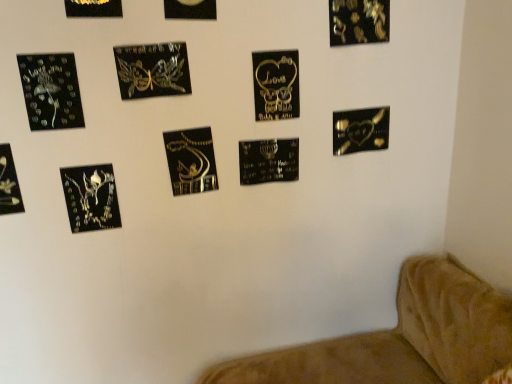
Locate an element on the screen. This screenshot has width=512, height=384. black glossy picture frame at upper center, the seventh picture frame viewed from the left is located at coordinates (190, 9).

This screenshot has height=384, width=512. What do you see at coordinates (276, 85) in the screenshot?
I see `black metallic plaque at center, placed as the third picture frame when sorted from right to left` at bounding box center [276, 85].

Locate an element on the screen. This screenshot has width=512, height=384. black metallic plaque at center, positioned as the ninth picture frame in left-to-right order is located at coordinates (276, 85).

How much space does black matte plaque at center, acting as the eighth picture frame starting from the left, occupy horizontally?

It is 1.59 inches.

Identify the location of black matte plaque at center, marked as the 4th picture frame in a right-to-left arrangement. (268, 161).

At what (x,y) coordinates should I click in order to perform the action: click on matte black bookmark at lower left, marked as the eleventh picture frame in a right-to-left arrangement. Please return your answer as a coordinate pair (x, y). Looking at the image, I should click on (9, 184).

How much space does matte black bookmark at lower left, marked as the eleventh picture frame in a right-to-left arrangement, occupy vertically?

matte black bookmark at lower left, marked as the eleventh picture frame in a right-to-left arrangement, is 8.39 inches tall.

How much space does black glossy picture frame at lower left, which is counted as the 3th picture frame, starting from the left, occupy horizontally?

The width of black glossy picture frame at lower left, which is counted as the 3th picture frame, starting from the left, is 1.72 centimeters.

Image resolution: width=512 pixels, height=384 pixels. What do you see at coordinates (91, 197) in the screenshot? I see `black glossy picture frame at lower left, which is counted as the 3th picture frame, starting from the left` at bounding box center [91, 197].

Describe the element at coordinates (358, 21) in the screenshot. The image size is (512, 384). I see `black glossy picture frame at upper right, which appears as the tenth picture frame when viewed from the left` at that location.

Where is `black glossy picture frame at upper center, which appears as the fifth picture frame when viewed from the right`? This screenshot has width=512, height=384. black glossy picture frame at upper center, which appears as the fifth picture frame when viewed from the right is located at coordinates (190, 9).

Is black metallic plaque at center, positioned as the ninth picture frame in left-to-right order, to the right of matte black bookmark at lower left, the 1th picture frame in the left-to-right sequence, from the viewer's perspective?

Yes.

Considering the relative sizes of black metallic plaque at center, positioned as the ninth picture frame in left-to-right order, and matte black bookmark at lower left, the 1th picture frame in the left-to-right sequence, in the image provided, is black metallic plaque at center, positioned as the ninth picture frame in left-to-right order, taller than matte black bookmark at lower left, the 1th picture frame in the left-to-right sequence,?

Indeed, black metallic plaque at center, positioned as the ninth picture frame in left-to-right order, has a greater height compared to matte black bookmark at lower left, the 1th picture frame in the left-to-right sequence.

How many degrees apart are the facing directions of black metallic plaque at center, placed as the third picture frame when sorted from right to left, and matte black bookmark at lower left, the 1th picture frame in the left-to-right sequence?

black metallic plaque at center, placed as the third picture frame when sorted from right to left, and matte black bookmark at lower left, the 1th picture frame in the left-to-right sequence, are facing 1.96 degrees away from each other.

From a real-world perspective, is black metallic plaque at center, placed as the third picture frame when sorted from right to left, on top of matte black bookmark at lower left, the 1th picture frame in the left-to-right sequence?

Correct, in the physical world, black metallic plaque at center, placed as the third picture frame when sorted from right to left, is higher than matte black bookmark at lower left, the 1th picture frame in the left-to-right sequence.

Locate an element on the screen. Image resolution: width=512 pixels, height=384 pixels. picture frame that is the 9th object located below the metallic gold picture frame at upper left, marked as the 8th picture frame in a right-to-left arrangement (from the image's perspective) is located at coordinates (91, 197).

Is metallic gold picture frame at upper left, marked as the 8th picture frame in a right-to-left arrangement, outside of black glossy picture frame at lower left, which is counted as the 3th picture frame, starting from the left?

Yes, metallic gold picture frame at upper left, marked as the 8th picture frame in a right-to-left arrangement, is not within black glossy picture frame at lower left, which is counted as the 3th picture frame, starting from the left.

Can you confirm if metallic gold picture frame at upper left, marked as the 8th picture frame in a right-to-left arrangement, is smaller than black glossy picture frame at lower left, which is counted as the 3th picture frame, starting from the left?

Indeed, metallic gold picture frame at upper left, marked as the 8th picture frame in a right-to-left arrangement, has a smaller size compared to black glossy picture frame at lower left, which is counted as the 3th picture frame, starting from the left.

Measure the distance between black glossy picture frame at lower left, which ranks as the 9th picture frame in right-to-left order, and black glossy picture frame at upper center, which appears as the fifth picture frame when viewed from the right.

black glossy picture frame at lower left, which ranks as the 9th picture frame in right-to-left order, is 22.38 inches away from black glossy picture frame at upper center, which appears as the fifth picture frame when viewed from the right.

Is black glossy picture frame at lower left, which ranks as the 9th picture frame in right-to-left order, spatially inside black glossy picture frame at upper center, the seventh picture frame viewed from the left, or outside of it?

black glossy picture frame at lower left, which ranks as the 9th picture frame in right-to-left order, is spatially situated outside black glossy picture frame at upper center, the seventh picture frame viewed from the left.

Considering the sizes of objects black glossy picture frame at lower left, which ranks as the 9th picture frame in right-to-left order, and black glossy picture frame at upper center, which appears as the fifth picture frame when viewed from the right, in the image provided, who is shorter, black glossy picture frame at lower left, which ranks as the 9th picture frame in right-to-left order, or black glossy picture frame at upper center, which appears as the fifth picture frame when viewed from the right,?

With less height is black glossy picture frame at upper center, which appears as the fifth picture frame when viewed from the right.

Is black glossy picture frame at lower left, which ranks as the 9th picture frame in right-to-left order, placed right next to black glossy picture frame at upper center, the seventh picture frame viewed from the left?

No, black glossy picture frame at lower left, which ranks as the 9th picture frame in right-to-left order, is not touching black glossy picture frame at upper center, the seventh picture frame viewed from the left.

Is black metallic plaque at center, positioned as the ninth picture frame in left-to-right order, bigger or smaller than matte black fairy at upper left, which is the 10th picture frame from right to left?

Clearly, black metallic plaque at center, positioned as the ninth picture frame in left-to-right order, is larger in size than matte black fairy at upper left, which is the 10th picture frame from right to left.

From a real-world perspective, which object rests below the other?

black metallic plaque at center, positioned as the ninth picture frame in left-to-right order.

In terms of width, does black metallic plaque at center, positioned as the ninth picture frame in left-to-right order, look wider or thinner when compared to matte black fairy at upper left, arranged as the second picture frame when viewed from the left?

Considering their sizes, black metallic plaque at center, positioned as the ninth picture frame in left-to-right order, looks broader than matte black fairy at upper left, arranged as the second picture frame when viewed from the left.

From the image's perspective, who appears lower, black metallic plaque at center, positioned as the ninth picture frame in left-to-right order, or matte black fairy at upper left, which is the 10th picture frame from right to left?

matte black fairy at upper left, which is the 10th picture frame from right to left, appears lower in the image.

In the image, is black matte plaque at center, marked as the 4th picture frame in a right-to-left arrangement, positioned in front of or behind metallic gold picture frame at upper left, positioned as the 4th picture frame in left-to-right order?

black matte plaque at center, marked as the 4th picture frame in a right-to-left arrangement, is positioned farther from the viewer than metallic gold picture frame at upper left, positioned as the 4th picture frame in left-to-right order.

Is black matte plaque at center, acting as the eighth picture frame starting from the left, not within metallic gold picture frame at upper left, positioned as the 4th picture frame in left-to-right order?

Yes.

From the image's perspective, count 6th picture frames upward from the black matte plaque at center, marked as the 4th picture frame in a right-to-left arrangement, and point to it. Please provide its 2D coordinates.

[(93, 8)]

Does black glossy picture frame at lower left, which ranks as the 9th picture frame in right-to-left order, have a greater width compared to metallic gold necklace at center, which is the sixth picture frame from right to left?

Incorrect, the width of black glossy picture frame at lower left, which ranks as the 9th picture frame in right-to-left order, does not surpass that of metallic gold necklace at center, which is the sixth picture frame from right to left.

From a real-world perspective, starting from the metallic gold necklace at center, which ranks as the 6th picture frame in left-to-right order, which picture frame is the 3rd one below it? Please provide its 2D coordinates.

[(91, 197)]

Looking at this image, is black glossy picture frame at lower left, which ranks as the 9th picture frame in right-to-left order, touching metallic gold necklace at center, which ranks as the 6th picture frame in left-to-right order?

No, black glossy picture frame at lower left, which ranks as the 9th picture frame in right-to-left order, is not making contact with metallic gold necklace at center, which ranks as the 6th picture frame in left-to-right order.

Is black glossy picture frame at lower left, which ranks as the 9th picture frame in right-to-left order, closer to the viewer compared to metallic gold necklace at center, which ranks as the 6th picture frame in left-to-right order?

That is True.

Is black glossy heart at lower right, which is the 1th picture frame in right-to-left order, to the left of matte black bookmark at lower left, the 1th picture frame in the left-to-right sequence, from the viewer's perspective?

No, black glossy heart at lower right, which is the 1th picture frame in right-to-left order, is not to the left of matte black bookmark at lower left, the 1th picture frame in the left-to-right sequence.

From a real-world perspective, who is located lower, black glossy heart at lower right, placed as the 11th picture frame when sorted from left to right, or matte black bookmark at lower left, marked as the eleventh picture frame in a right-to-left arrangement?

From a 3D spatial view, matte black bookmark at lower left, marked as the eleventh picture frame in a right-to-left arrangement, is below.

Which object is more forward, black glossy heart at lower right, which is the 1th picture frame in right-to-left order, or matte black bookmark at lower left, the 1th picture frame in the left-to-right sequence?

Positioned in front is matte black bookmark at lower left, the 1th picture frame in the left-to-right sequence.

Does black glossy heart at lower right, placed as the 11th picture frame when sorted from left to right, turn towards matte black bookmark at lower left, the 1th picture frame in the left-to-right sequence?

No, black glossy heart at lower right, placed as the 11th picture frame when sorted from left to right, is not aimed at matte black bookmark at lower left, the 1th picture frame in the left-to-right sequence.

Which picture frame is the 8th one when counting from the right side of the matte black bookmark at lower left, the 1th picture frame in the left-to-right sequence? Please provide its 2D coordinates.

[(276, 85)]

Image resolution: width=512 pixels, height=384 pixels. I want to click on the 5th picture frame in front of the black glossy picture frame at lower left, which ranks as the 9th picture frame in right-to-left order, starting your count from the anchor, so click(93, 8).

Looking at the image, which one is located closer to black glossy picture frame at upper center, the seventh picture frame viewed from the left, black glossy heart at lower right, which is the 1th picture frame in right-to-left order, or black metallic plaque at center, placed as the third picture frame when sorted from right to left?

The object closer to black glossy picture frame at upper center, the seventh picture frame viewed from the left, is black metallic plaque at center, placed as the third picture frame when sorted from right to left.

Which object lies nearer to the anchor point metallic gold butterfly at upper center, placed as the 7th picture frame when sorted from right to left, black glossy picture frame at upper right, which appears as the tenth picture frame when viewed from the left, or black glossy heart at lower right, placed as the 11th picture frame when sorted from left to right?

black glossy picture frame at upper right, which appears as the tenth picture frame when viewed from the left.

Looking at the image, which one is located closer to black glossy heart at lower right, which is the 1th picture frame in right-to-left order, metallic gold necklace at center, which is the sixth picture frame from right to left, or matte black fairy at upper left, which is the 10th picture frame from right to left?

metallic gold necklace at center, which is the sixth picture frame from right to left.

Considering their positions, is metallic gold butterfly at upper center, marked as the fifth picture frame in a left-to-right arrangement, positioned closer to metallic gold necklace at center, which ranks as the 6th picture frame in left-to-right order, than matte black bookmark at lower left, marked as the eleventh picture frame in a right-to-left arrangement?

metallic gold butterfly at upper center, marked as the fifth picture frame in a left-to-right arrangement, is positioned closer to the anchor metallic gold necklace at center, which ranks as the 6th picture frame in left-to-right order.

Looking at the image, which one is located further to metallic gold butterfly at upper center, placed as the 7th picture frame when sorted from right to left, matte black fairy at upper left, arranged as the second picture frame when viewed from the left, or black glossy heart at lower right, which is the 1th picture frame in right-to-left order?

black glossy heart at lower right, which is the 1th picture frame in right-to-left order, is further to metallic gold butterfly at upper center, placed as the 7th picture frame when sorted from right to left.

Estimate the real-world distances between objects in this image. Which object is closer to black glossy picture frame at upper right, which appears as the tenth picture frame when viewed from the left, matte black bookmark at lower left, the 1th picture frame in the left-to-right sequence, or metallic gold picture frame at upper left, marked as the 8th picture frame in a right-to-left arrangement?

metallic gold picture frame at upper left, marked as the 8th picture frame in a right-to-left arrangement.

From the image, which object appears to be farther from black metallic plaque at center, placed as the third picture frame when sorted from right to left, metallic gold necklace at center, which is the sixth picture frame from right to left, or matte black bookmark at lower left, marked as the eleventh picture frame in a right-to-left arrangement?

matte black bookmark at lower left, marked as the eleventh picture frame in a right-to-left arrangement, lies further to black metallic plaque at center, placed as the third picture frame when sorted from right to left, than the other object.

Which object lies nearer to the anchor point black glossy picture frame at upper right, which appears as the tenth picture frame when viewed from the left, metallic gold butterfly at upper center, placed as the 7th picture frame when sorted from right to left, or metallic gold picture frame at upper left, positioned as the 4th picture frame in left-to-right order?

metallic gold butterfly at upper center, placed as the 7th picture frame when sorted from right to left, is positioned closer to the anchor black glossy picture frame at upper right, which appears as the tenth picture frame when viewed from the left.